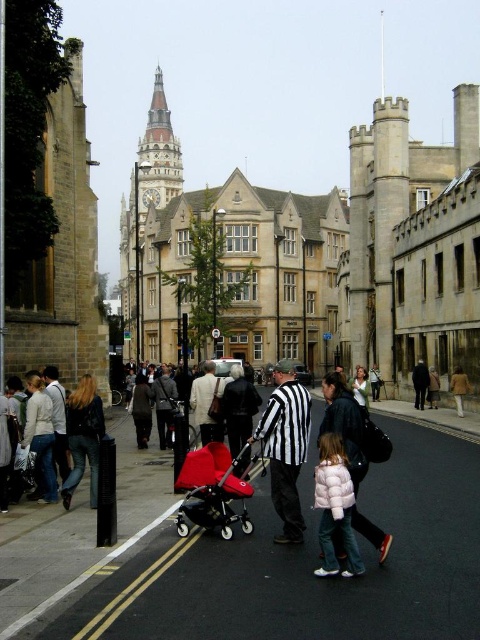
You are standing on the street in the historic European town. You see a man wearing a black and white striped shirt at center. Where is he located relative to the clock tower?

The black and white striped shirt at center is located at point (286, 445), which is in the foreground near the paved road, closer to the viewer than the clock tower in the background.

Looking at this image, you are a delivery person trying to navigate through the busy street. There is a smooth concrete pavement at center and a matte red baby carriage at center. Can you pass between them without moving either object?

The smooth concrete pavement at center is 15.51 feet away from the matte red baby carriage at center, so yes, you can pass between them without moving either object since there is sufficient space.

You are standing in the historic town square and want to take a photo of the point at coordinates (386,568). If your camera has a maximum focus range of 100 feet, will you be able to capture the point clearly?

The point at coordinates (386,568) is 108.34 feet away from the camera, which exceeds the maximum focus range of 100 feet. Therefore, the camera will not be able to capture the point clearly.